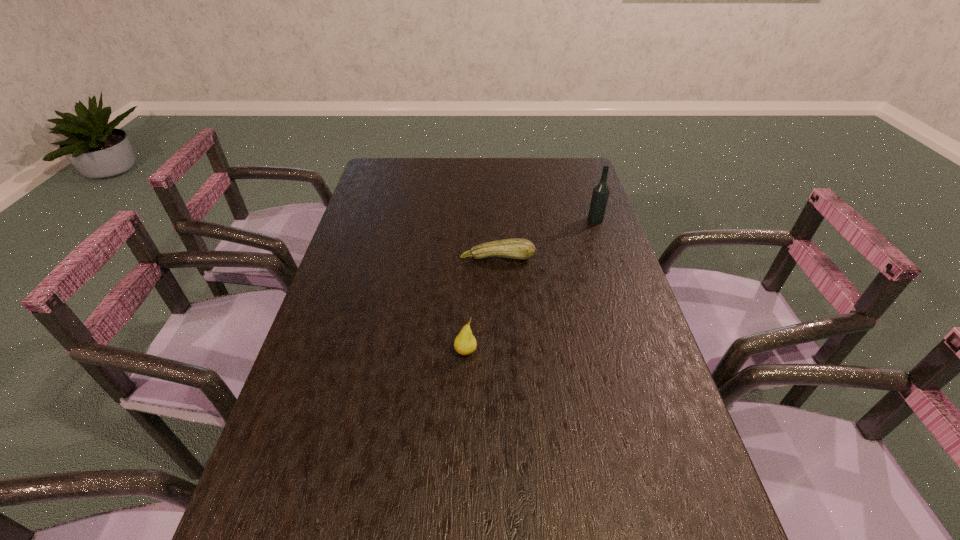
Where is `the farthest object`? Image resolution: width=960 pixels, height=540 pixels. the farthest object is located at coordinates (600, 195).

You are a GUI agent. You are given a task and a screenshot of the screen. Output one action in this format:
    pyautogui.click(x=<x>, y=<y>)
    Task: Click on the rightmost object
    
    Given the screenshot: What is the action you would take?
    pyautogui.click(x=600, y=195)

Identify the location of pear. The width and height of the screenshot is (960, 540). (465, 343).

Identify the location of the nearest object. The width and height of the screenshot is (960, 540). (465, 343).

In order to click on the shortest object in this screenshot , I will do `click(516, 248)`.

Identify the location of the second farthest object. (516, 248).

The image size is (960, 540). Find the location of `free space located on the back of the farthest object`. free space located on the back of the farthest object is located at coordinates (585, 187).

At what (x,y) coordinates should I click in order to perform the action: click on free space located on the right of the pear. Please return your answer as a coordinate pair (x, y). Looking at the image, I should click on (536, 352).

Locate an element on the screen. blank space located at the stem end of the shortest object is located at coordinates (499, 295).

Find the location of a particular element. The image size is (960, 540). object that is at the right edge is located at coordinates (600, 195).